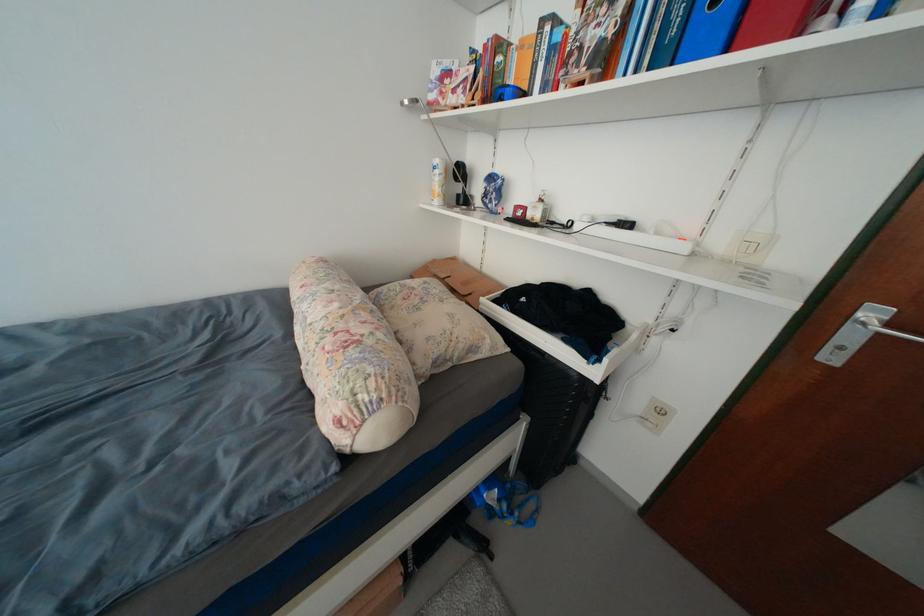
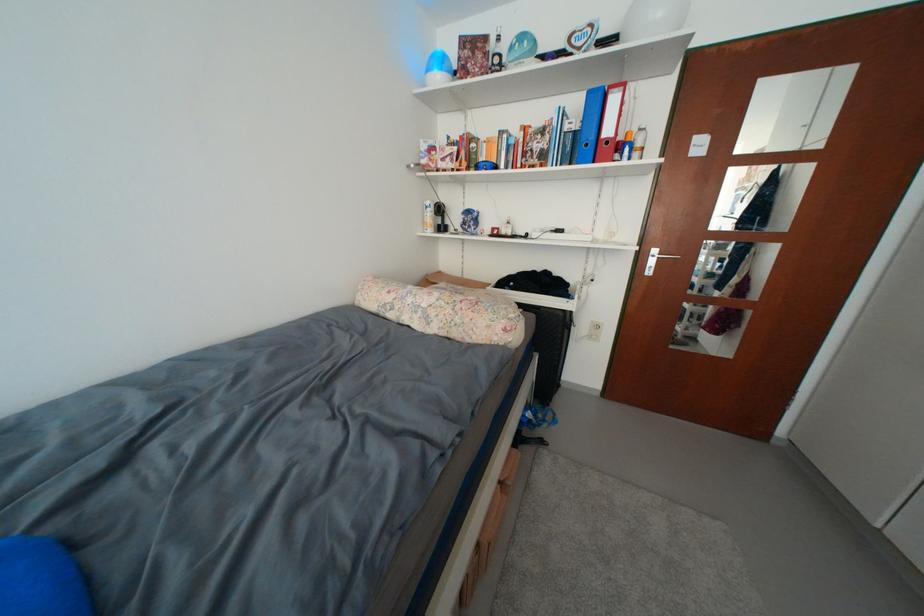
The point at (x=441, y=193) is marked in the first image. Where is the corresponding point in the second image?

(432, 225)